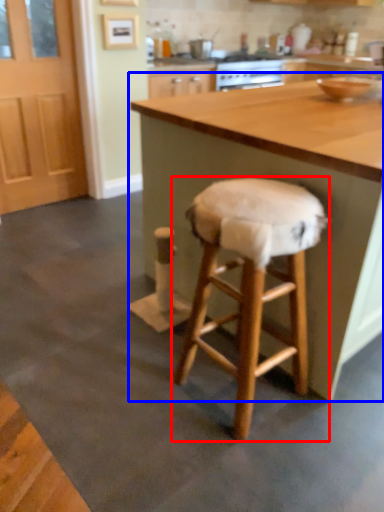
Question: Which of the following is the closest to the observer, stool (highlighted by a red box) or table (highlighted by a blue box)?

Choices:
 (A) stool
 (B) table

Answer: (A)